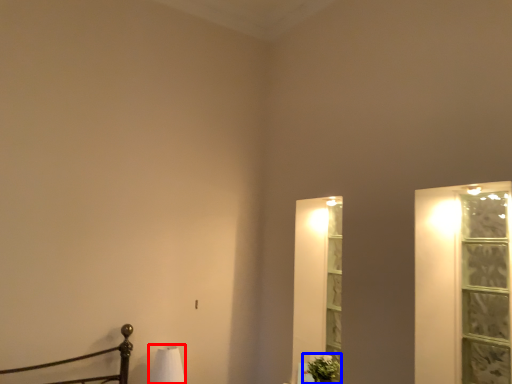
Question: Which point is further to the camera, table lamp (highlighted by a red box) or plant (highlighted by a blue box)?

Choices:
 (A) table lamp
 (B) plant

Answer: (B)